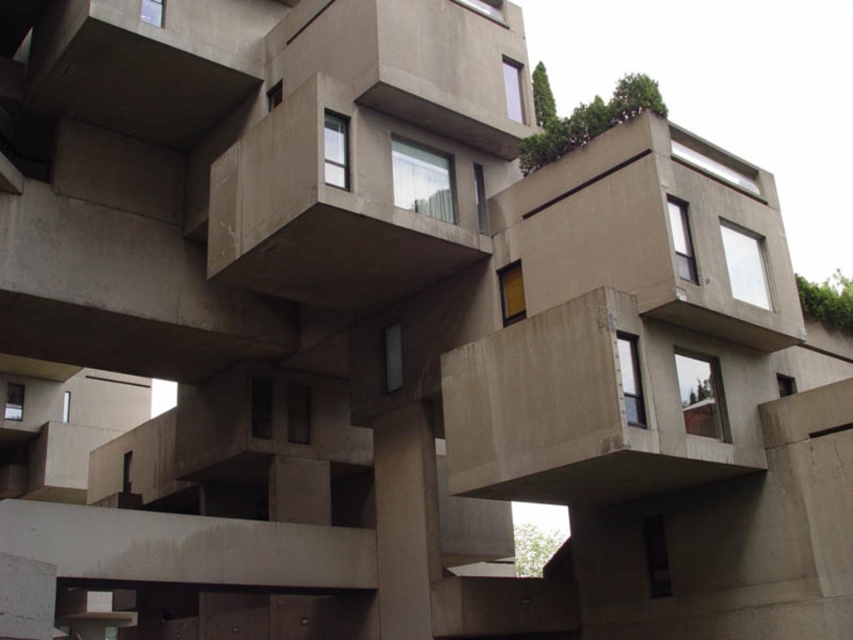
Question: Where is concrete at center located in relation to concrete balcony at center in the image?

Choices:
 (A) right
 (B) left

Answer: (A)

Question: Is the position of concrete at center less distant than that of concrete balcony at center?

Choices:
 (A) no
 (B) yes

Answer: (B)

Question: Does concrete at center appear on the right side of concrete balcony at center?

Choices:
 (A) yes
 (B) no

Answer: (A)

Question: Which point is closer to the camera taking this photo?

Choices:
 (A) click(x=650, y=410)
 (B) click(x=318, y=115)

Answer: (A)

Question: Which point appears closest to the camera in this image?

Choices:
 (A) (260, 132)
 (B) (672, 464)

Answer: (B)